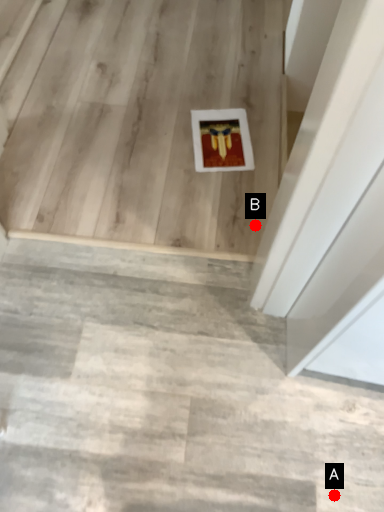
Question: Two points are circled on the image, labeled by A and B beside each circle. Which of the following is the closest to the observer?

Choices:
 (A) A is closer
 (B) B is closer

Answer: (A)